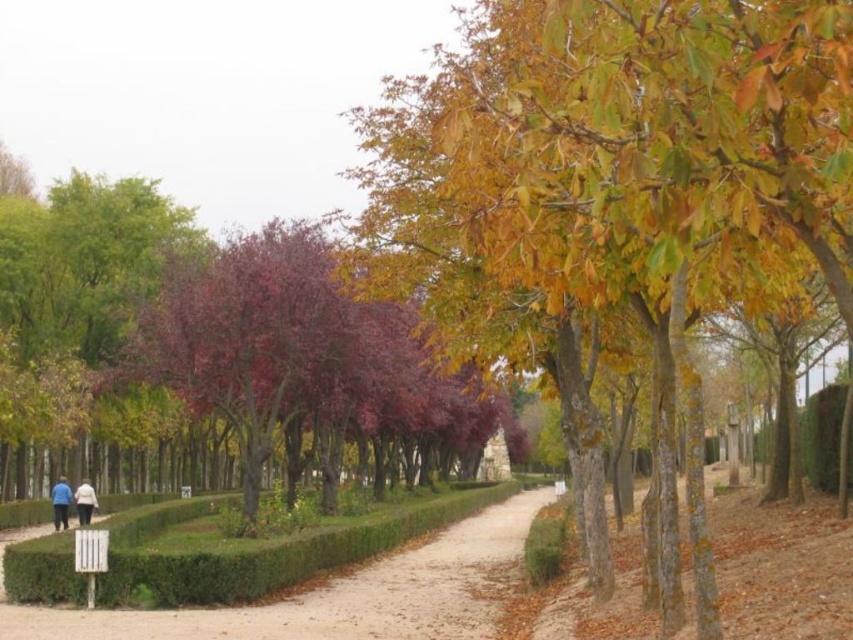
Can you confirm if green hedge at lower left is bigger than blue fabric jacket at lower left?

Correct, green hedge at lower left is larger in size than blue fabric jacket at lower left.

I want to click on green hedge at lower left, so click(x=334, y=595).

The width and height of the screenshot is (853, 640). What are the coordinates of `purple glossy tree at center` in the screenshot? It's located at (294, 355).

Does purple glossy tree at center have a greater height compared to white fabric person at lower left?

Correct, purple glossy tree at center is much taller as white fabric person at lower left.

Who is more forward, (296, 352) or (86, 492)?

Point (296, 352)

The width and height of the screenshot is (853, 640). I want to click on purple glossy tree at center, so click(x=294, y=355).

Looking at this image, is yellow-green bark tree at center-right to the right of blue fabric jacket at lower left from the viewer's perspective?

Yes, yellow-green bark tree at center-right is to the right of blue fabric jacket at lower left.

Is yellow-green bark tree at center-right smaller than blue fabric jacket at lower left?

Actually, yellow-green bark tree at center-right might be larger than blue fabric jacket at lower left.

Locate an element on the screen. Image resolution: width=853 pixels, height=640 pixels. yellow-green bark tree at center-right is located at coordinates (613, 152).